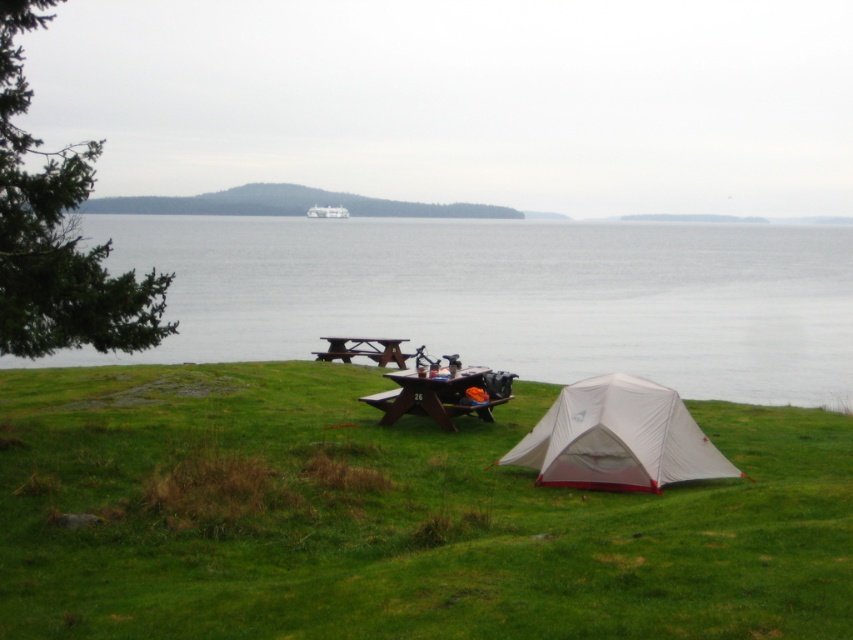
Question: Which object is closer to the camera taking this photo?

Choices:
 (A) wooden picnic table at center
 (B) white matte boat at center

Answer: (A)

Question: Among these objects, which one is nearest to the camera?

Choices:
 (A) wooden picnic table at center
 (B) white matte boat at center

Answer: (A)

Question: Which point appears farthest from the camera in this image?

Choices:
 (A) (103, 237)
 (B) (323, 209)
 (C) (456, 404)

Answer: (B)

Question: Does green grassy at lower center appear under white matte boat at center?

Choices:
 (A) no
 (B) yes

Answer: (B)

Question: Can you confirm if white nylon tent at lower right is thinner than brown wooden picnic table at center?

Choices:
 (A) yes
 (B) no

Answer: (B)

Question: Does transparent water at center appear on the right side of wooden picnic table at center?

Choices:
 (A) yes
 (B) no

Answer: (A)